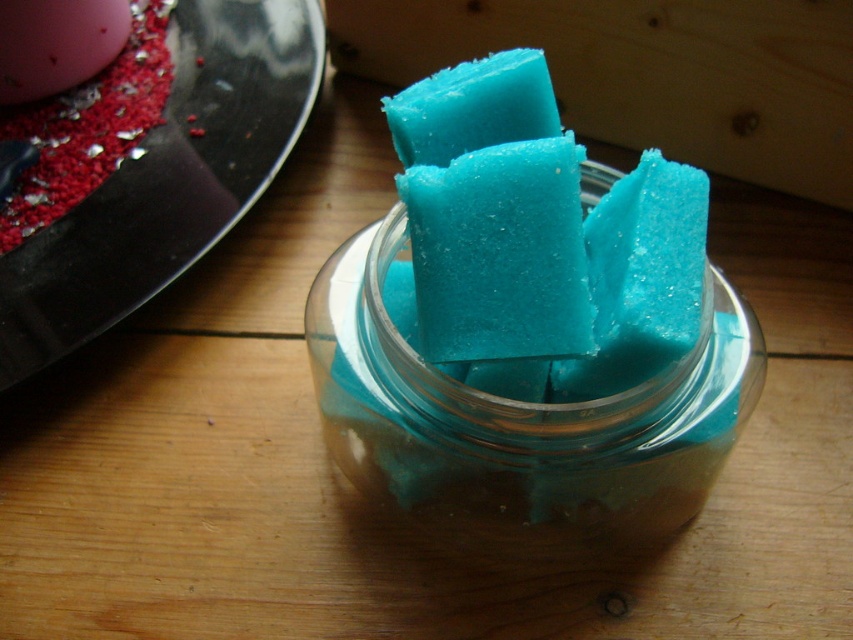
You are organizing a craft fair booth and need to arrange items on a table. You have a transparent glass jar at center and a blue translucent soap at center. According to the scene, which item is positioned to the left?

The blue translucent soap at center is positioned to the left of the transparent glass jar at center.

You have a small container that can hold items up to 5 cm in width. You need to place either the transparent glass jar at center or the blue translucent soap at center into it. Which one can fit?

The blue translucent soap at center can fit into the container since it is smaller than the transparent glass jar at center, which might not fit due to its wider size.